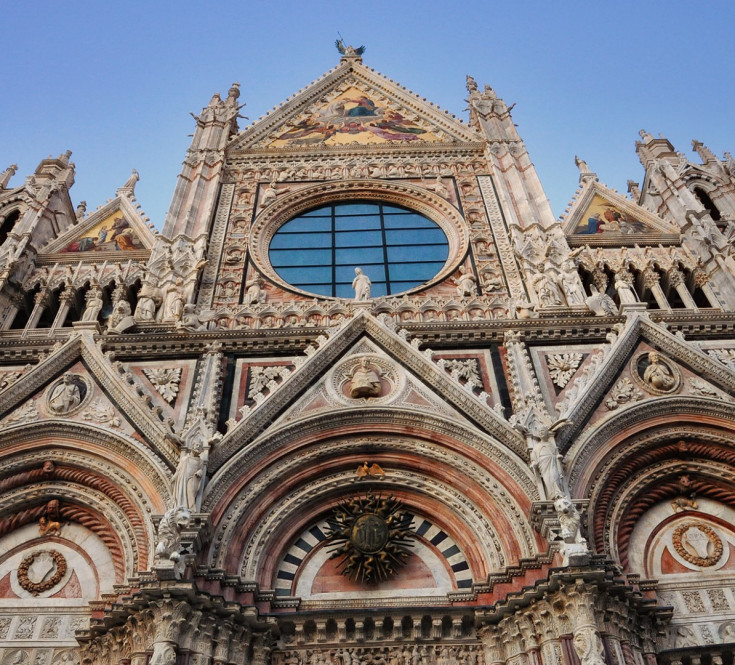
Image resolution: width=735 pixels, height=665 pixels. I want to click on circular window, so click(367, 233).